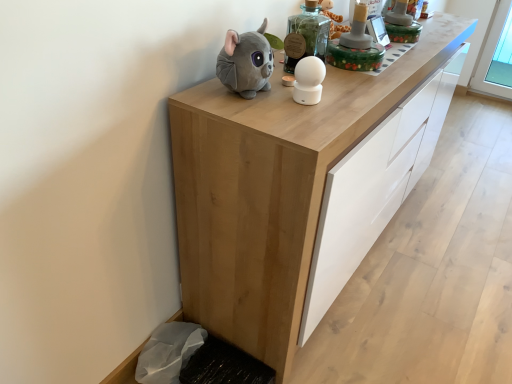
The image size is (512, 384). I want to click on free space that is in between white matte ball at center, which is the 2th toy in left-to-right order, and soft gray plush toy at upper center, the 1th toy positioned from the left, so click(282, 104).